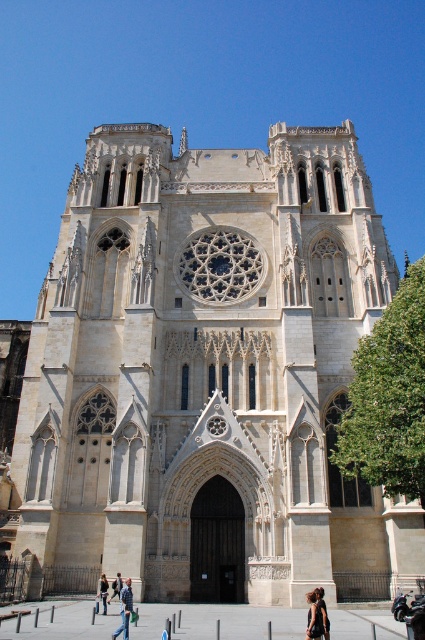
Locate an element on the screen. This screenshot has width=425, height=640. blue denim jeans at lower left is located at coordinates (124, 609).

Which is behind, point (124, 586) or point (119, 589)?

Point (119, 589)

This screenshot has height=640, width=425. Find the location of `blue denim jeans at lower left`. blue denim jeans at lower left is located at coordinates (124, 609).

Is blue denim jeans at lower left further to camera compared to black fabric at lower center?

Yes, it is.

Is blue denim jeans at lower left to the right of black fabric at lower center from the viewer's perspective?

In fact, blue denim jeans at lower left is to the left of black fabric at lower center.

Measure the distance between blue denim jeans at lower left and camera.

blue denim jeans at lower left is 105.97 feet from camera.

Identify the location of blue denim jeans at lower left. (124, 609).

Between dark brown hair at lower center and black fabric at lower center, which one appears on the left side from the viewer's perspective?

dark brown hair at lower center is more to the left.

Where is `dark brown hair at lower center`? The height and width of the screenshot is (640, 425). dark brown hair at lower center is located at coordinates (314, 618).